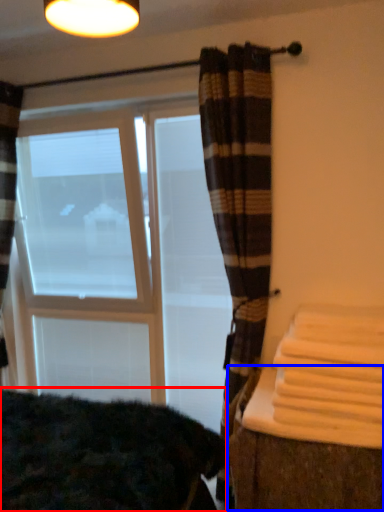
Question: Which of the following is the farthest to the observer, bedding (highlighted by a red box) or table (highlighted by a blue box)?

Choices:
 (A) bedding
 (B) table

Answer: (B)